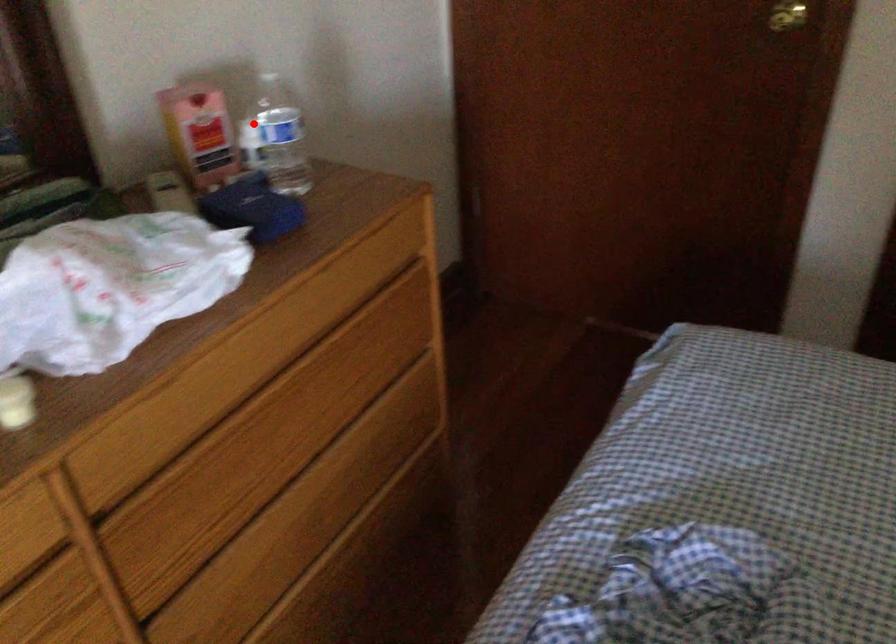
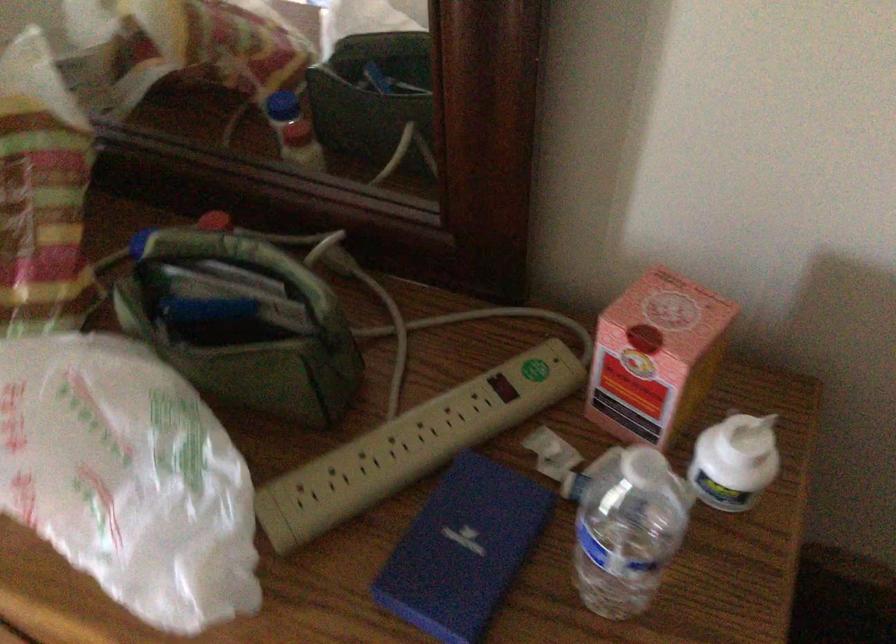
In the second image, find the point that corresponds to the highlighted location in the first image.

(754, 435)